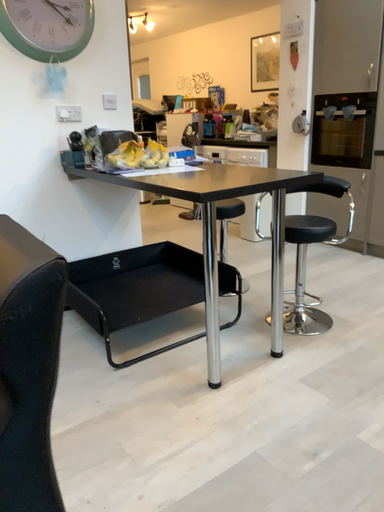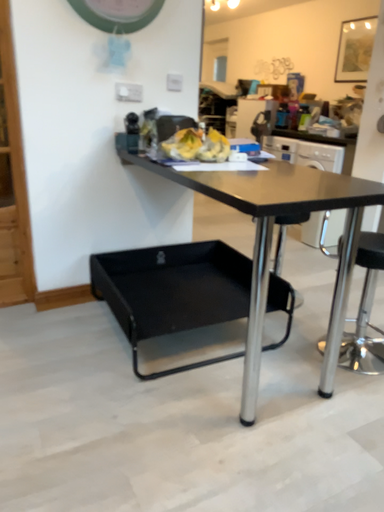
Question: How did the camera likely rotate when shooting the video?

Choices:
 (A) rotated right
 (B) rotated left

Answer: (B)